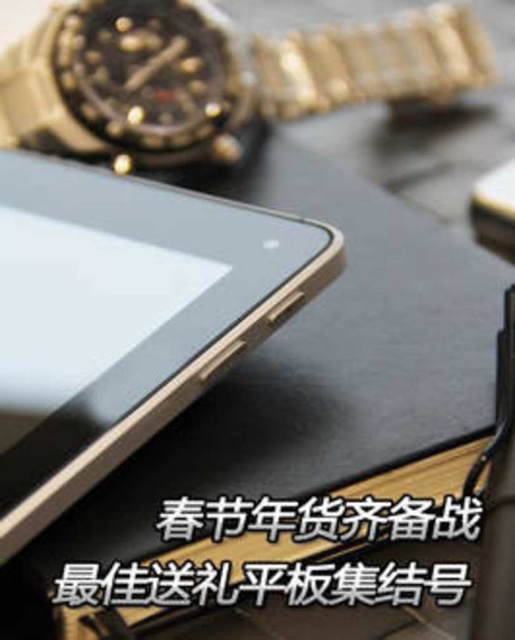
Question: From the image, what is the correct spatial relationship of gold metallic tablet at upper left in relation to gold metallic watch at upper left?

Choices:
 (A) right
 (B) left

Answer: (B)

Question: In this image, where is gold metallic tablet at upper left located relative to gold metallic watch at upper left?

Choices:
 (A) right
 (B) left

Answer: (B)

Question: Does gold metallic tablet at upper left appear under gold metallic watch at upper left?

Choices:
 (A) no
 (B) yes

Answer: (B)

Question: Among these objects, which one is farthest from the camera?

Choices:
 (A) gold metallic watch at upper left
 (B) gold metallic tablet at upper left

Answer: (A)